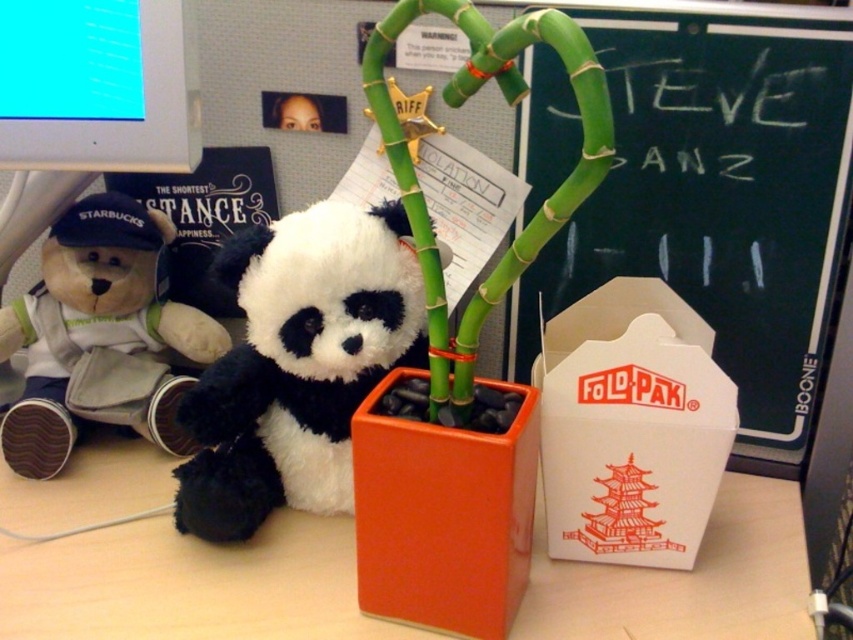
Which is below, black chalkboard at upper right or orange glossy cube at center?

orange glossy cube at center

Is the position of black chalkboard at upper right less distant than that of orange glossy cube at center?

No, black chalkboard at upper right is further to the viewer.

At what (x,y) coordinates should I click in order to perform the action: click on black chalkboard at upper right. Please return your answer as a coordinate pair (x, y). This screenshot has width=853, height=640. Looking at the image, I should click on (720, 198).

This screenshot has width=853, height=640. What are the coordinates of `black chalkboard at upper right` in the screenshot? It's located at (720, 198).

Can you confirm if orange matte table at center is shorter than white paper box at center?

Yes, orange matte table at center is shorter than white paper box at center.

Is point (596, 572) positioned behind point (614, 342)?

Yes, it is behind point (614, 342).

Describe the element at coordinates (189, 584) in the screenshot. The height and width of the screenshot is (640, 853). I see `orange matte table at center` at that location.

Where is `orange matte table at center`? Image resolution: width=853 pixels, height=640 pixels. orange matte table at center is located at coordinates (189, 584).

Is point (260, 584) positioned after point (33, 344)?

No, it is not.

Can you confirm if orange matte table at center is bigger than brown plush bear at left?

Correct, orange matte table at center is larger in size than brown plush bear at left.

Does point (231, 554) come closer to viewer compared to point (97, 307)?

Yes, it is.

Where is `orange matte table at center`? This screenshot has width=853, height=640. orange matte table at center is located at coordinates (189, 584).